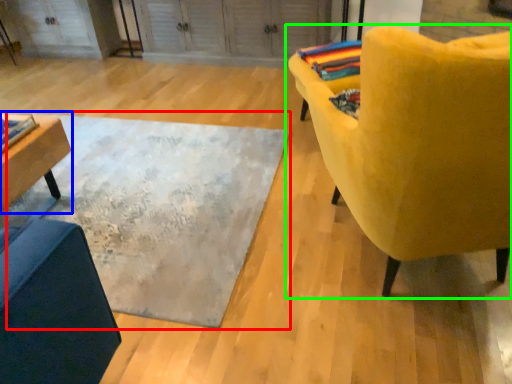
Question: Considering the real-world distances, which object is farthest from mat (highlighted by a red box)? table (highlighted by a blue box) or chair (highlighted by a green box)?

Choices:
 (A) table
 (B) chair

Answer: (B)